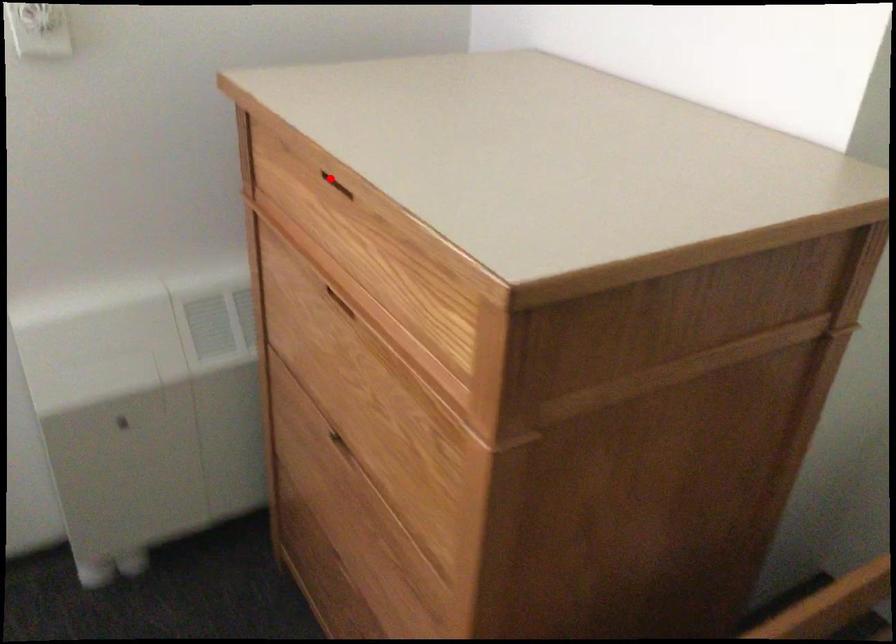
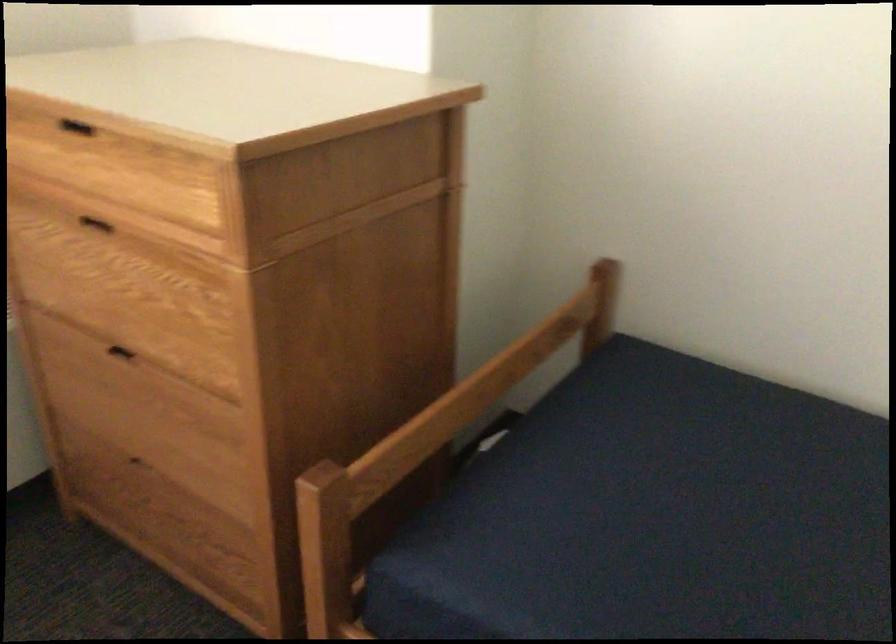
Question: I am providing you with two images of the same scene from different viewpoints. In image1, a red point is highlighted. Considering the same 3D point in image2, which of the following is correct?

Choices:
 (A) It is closer
 (B) It is farther

Answer: (B)